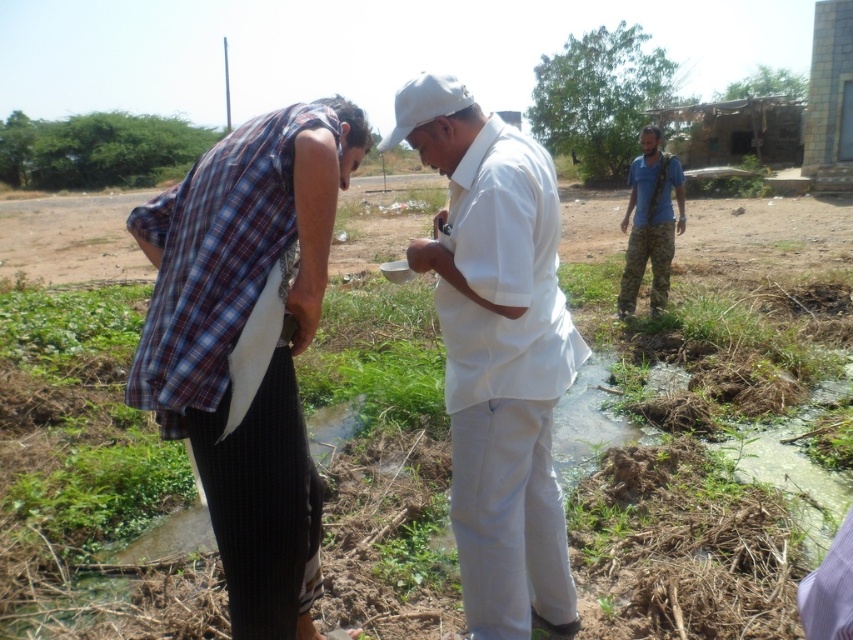
Image resolution: width=853 pixels, height=640 pixels. What do you see at coordinates (236, 339) in the screenshot? I see `plaid fabric shirt at left` at bounding box center [236, 339].

Identify the location of plaid fabric shirt at left. (236, 339).

Is point (235, 161) farther from camera compared to point (570, 355)?

No, it is not.

The image size is (853, 640). Find the location of `plaid fabric shirt at left`. plaid fabric shirt at left is located at coordinates (236, 339).

Which is behind, point (347, 141) or point (672, 230)?

Point (672, 230)

Does plaid fabric shirt at left have a greater width compared to camouflage pants at right?

Correct, the width of plaid fabric shirt at left exceeds that of camouflage pants at right.

Which is behind, point (218, 444) or point (660, 262)?

Point (660, 262)

Where is `plaid fabric shirt at left`? This screenshot has height=640, width=853. plaid fabric shirt at left is located at coordinates (236, 339).

Can you confirm if white matte shirt at center is smaller than camouflage pants at right?

Incorrect, white matte shirt at center is not smaller in size than camouflage pants at right.

From the picture: Does white matte shirt at center come in front of camouflage pants at right?

Yes, it is.

Find the location of a particular element. The height and width of the screenshot is (640, 853). white matte shirt at center is located at coordinates (497, 353).